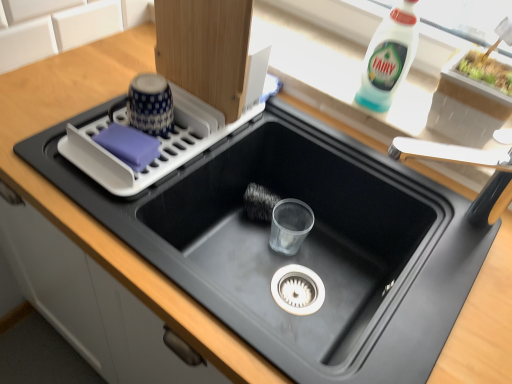
The height and width of the screenshot is (384, 512). Find the location of `vacant location behind white plastic faucet at upper right`. vacant location behind white plastic faucet at upper right is located at coordinates (401, 161).